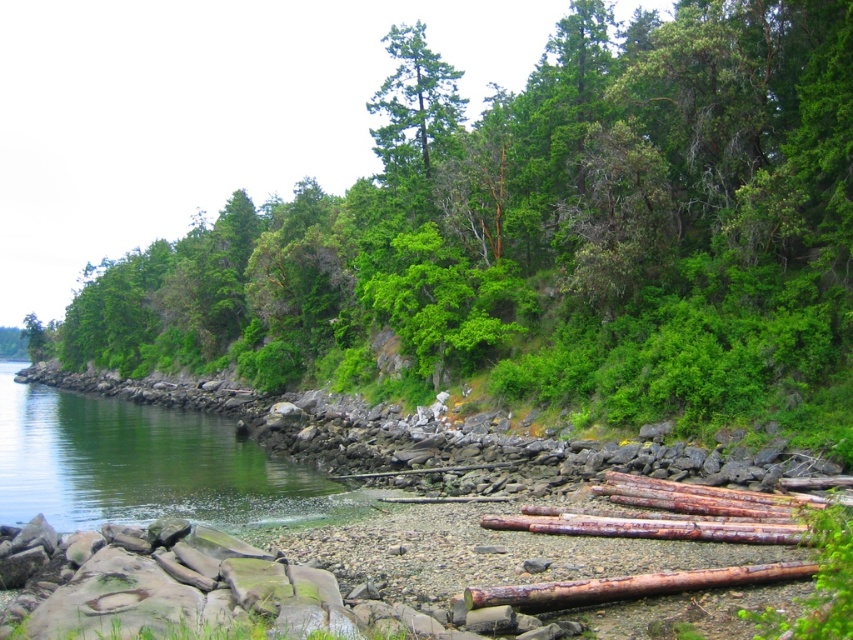
Question: Which point is farther from the camera taking this photo?

Choices:
 (A) (410, 161)
 (B) (131, 488)

Answer: (A)

Question: Does green leafy tree at center appear under green matte tree at upper center?

Choices:
 (A) yes
 (B) no

Answer: (A)

Question: From the image, what is the correct spatial relationship of green smooth water at lower left in relation to green matte tree at upper center?

Choices:
 (A) above
 (B) below

Answer: (B)

Question: Which point is closer to the camera taking this photo?

Choices:
 (A) (122, 476)
 (B) (436, 141)
 (C) (425, 198)
 (D) (592, 593)

Answer: (D)

Question: From the image, what is the correct spatial relationship of green smooth water at lower left in relation to rusty wood log at lower right?

Choices:
 (A) right
 (B) left

Answer: (B)

Question: Which point is farther to the camera?

Choices:
 (A) (698, 586)
 (B) (390, 161)
 (C) (347, 225)
 (D) (215, 445)

Answer: (C)